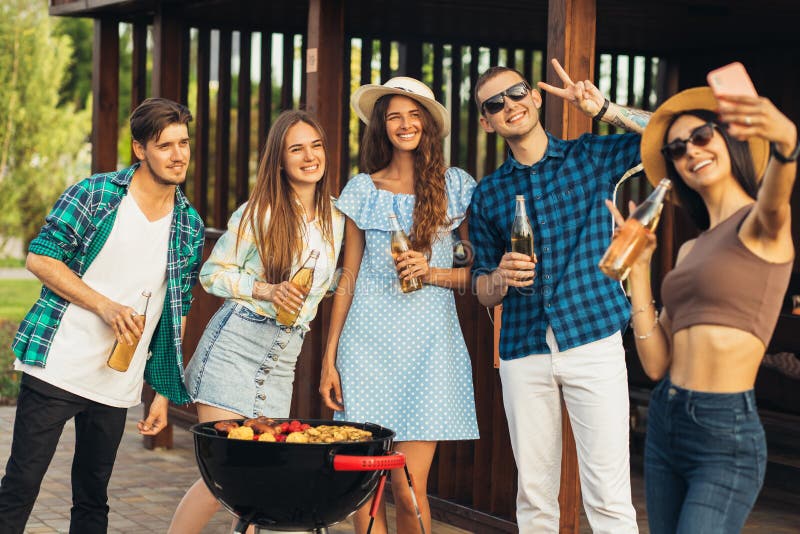
Locate an element on the screen. pillars is located at coordinates (576, 36), (328, 38), (164, 56), (97, 66).